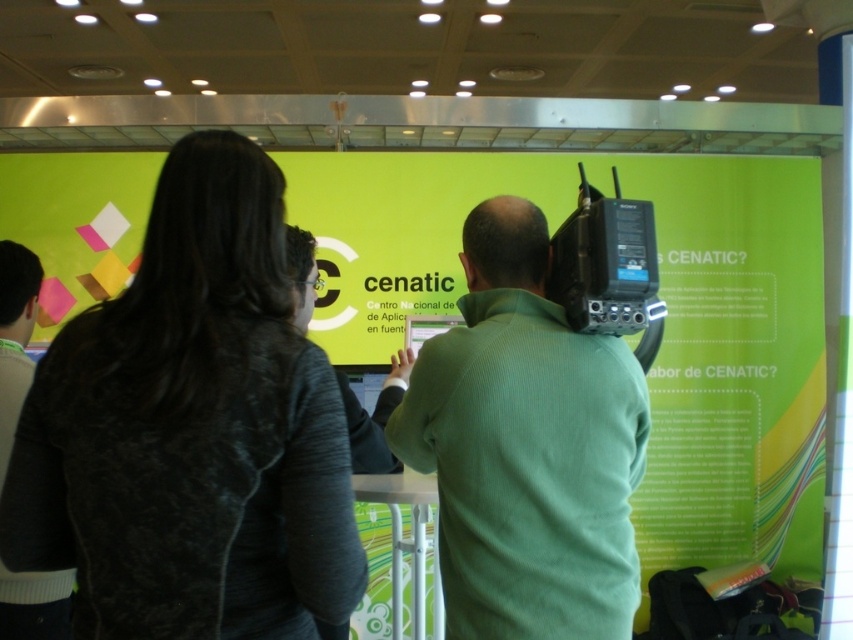
You are standing in front of the large display screen at the event. You notice two points marked on the screen. The first point is at coordinates point (3, 342) and the second point is at point (395, 384). Which point is closer to you?

Point (3, 342) is closer to the camera than point (395, 384).

You are a photographer at the event and need to capture a photo of both the green ribbed sweater at center and the green matte shirt at center in the same frame. The camera you are using has a minimum focus distance of 15 inches. Can you take the photo without moving either person?

The green ribbed sweater at center is 15.37 inches from the green matte shirt at center. Since the camera requires a minimum focus distance of 15 inches, the distance between them is sufficient. Therefore, you can take the photo without moving either person.

You are at a tech exhibition and see the green matte poster at center and the green ribbed sweater at center. Which object is positioned higher in the image?

The green matte poster at center is positioned higher than the green ribbed sweater at center.